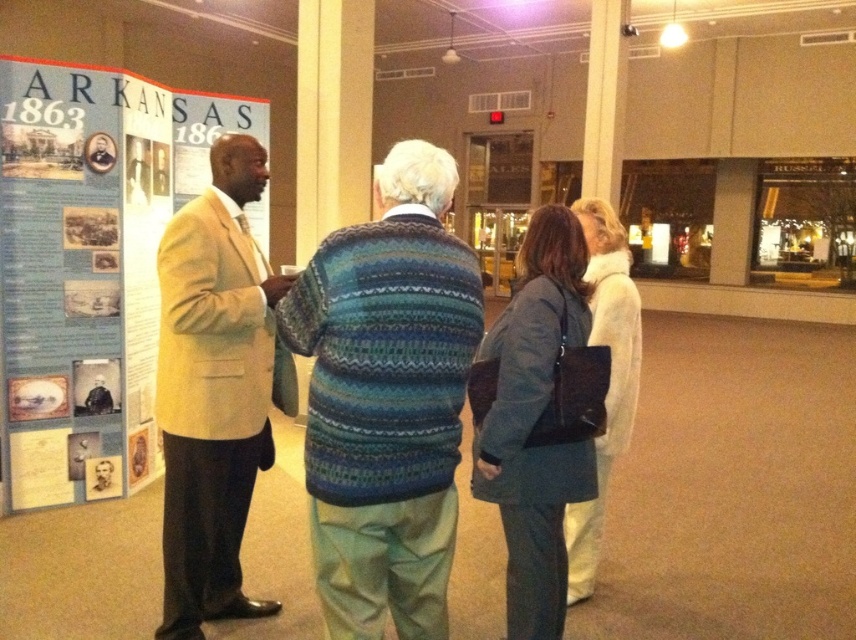
You are standing in front of the display board titled ARKANSAS 1863. There are two points marked on the board at coordinates point [96,227] and point [572,385]. If you want to touch the point that is closer to you, which one should you choose?

Point [96,227] is further to the camera than point [572,385]. Therefore, the point closer to you is point [572,385].

You are standing in the museum and want to locate the blue paper poster at left. What are the coordinates where you should look?

The blue paper poster at left is located at coordinates point (88,266).